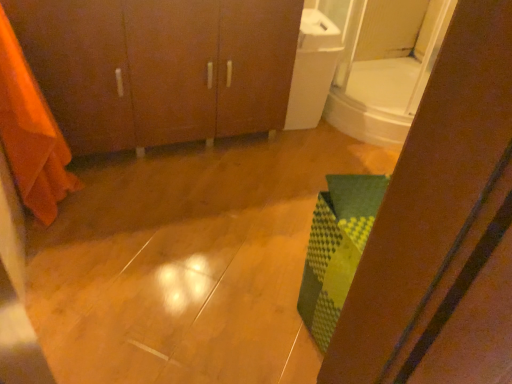
Question: Is orange fabric at left to the left or to the right of matte wood cabinet at upper left in the image?

Choices:
 (A) right
 (B) left

Answer: (B)

Question: From their relative heights in the image, would you say orange fabric at left is taller or shorter than matte wood cabinet at upper left?

Choices:
 (A) short
 (B) tall

Answer: (B)

Question: Considering the real-world distances, which object is farthest from the orange fabric at left?

Choices:
 (A) matte wood cabinet at upper left
 (B) white glossy mirror at upper right

Answer: (B)

Question: Which object is the farthest from the white glossy mirror at upper right?

Choices:
 (A) orange fabric at left
 (B) matte wood cabinet at upper left

Answer: (A)